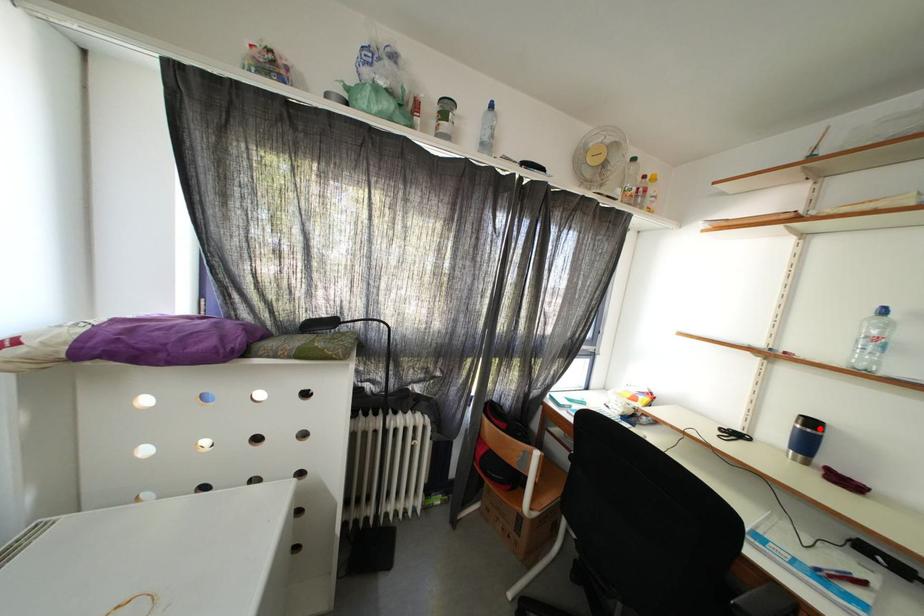
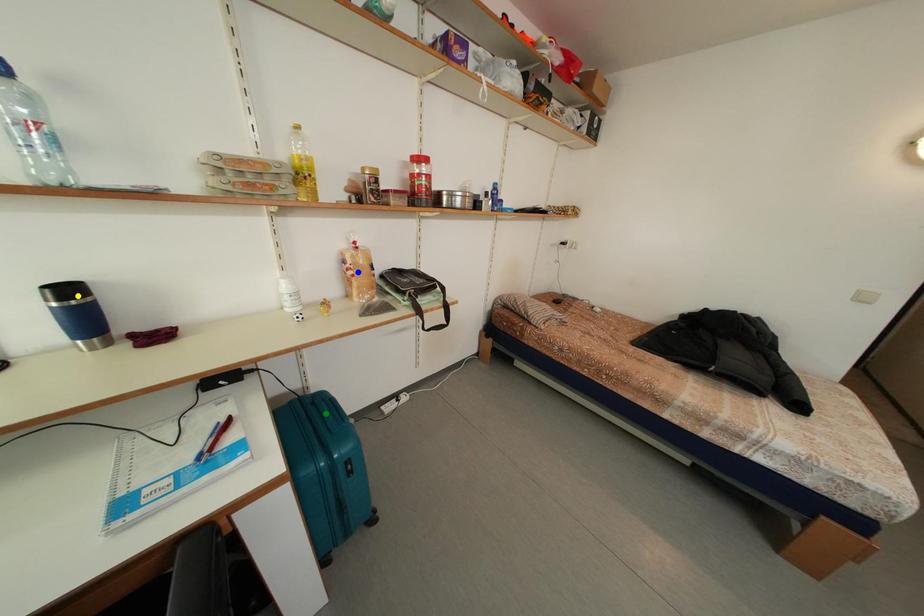
Question: I am providing you with two images of the same scene from different viewpoints. A red point is marked on the first image. You are given multiple points on the second image. Which point in image 2 is actually the same real-world point as the red point in image 1?

Choices:
 (A) yellow point
 (B) green point
 (C) blue point

Answer: (A)